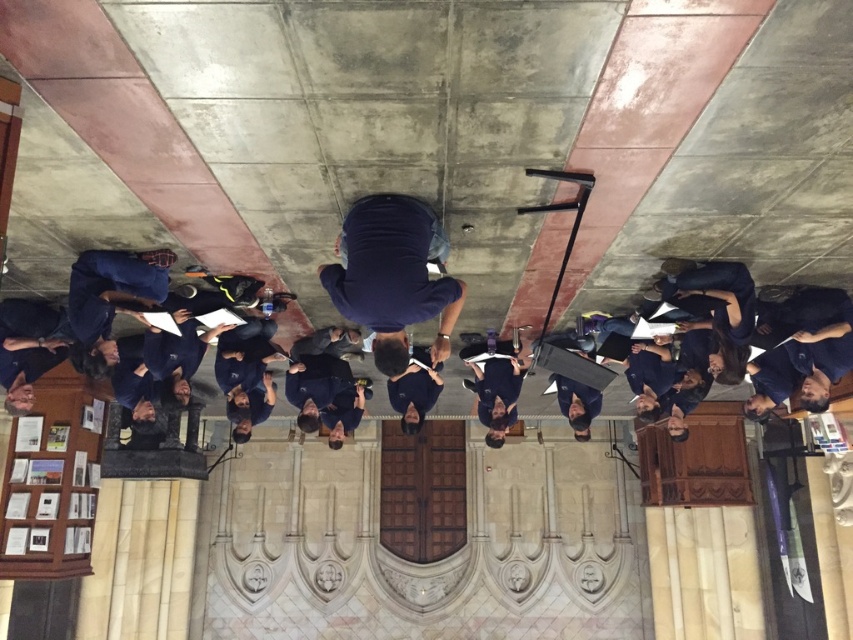
You are standing in the church and want to approach the two people wearing dark blue shirt at center and dark blue uniform at center. Which one should you walk towards first to reach the closer one?

You should walk towards the dark blue shirt at center first because it is closer to you than the dark blue uniform at center.

From the picture: You are a photographer trying to capture a group photo of the choir members. You notice two dark blue shirt at center and dark blue uniform at center in the scene. Which of these two items would likely require a wider frame to include fully in the photo?

The dark blue shirt at center might be wider than dark blue uniform at center, so it would likely require a wider frame to include fully in the photo.